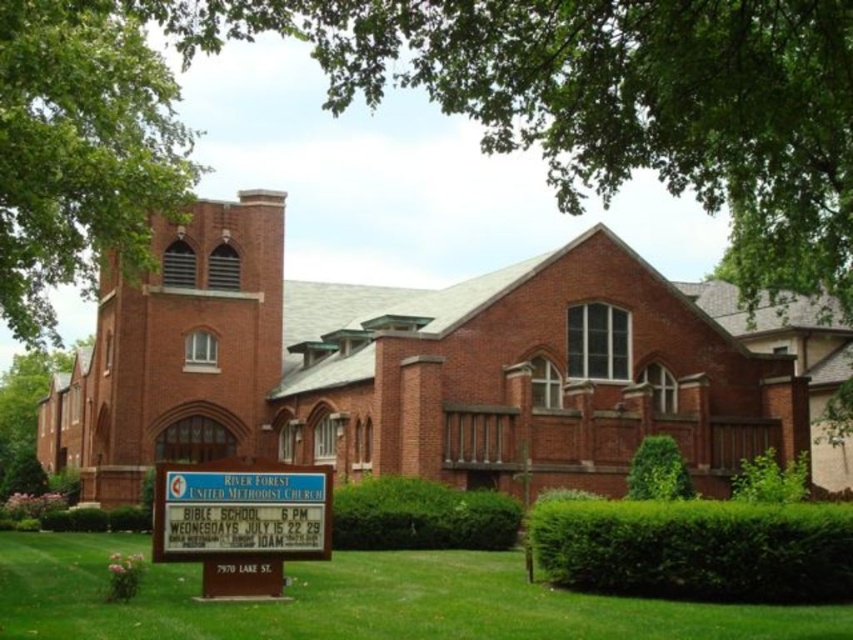
Question: Is brick church at center bigger than white plastic sign at lower center?

Choices:
 (A) no
 (B) yes

Answer: (B)

Question: Does white plastic sign at lower center appear over green leafy hedge at center?

Choices:
 (A) no
 (B) yes

Answer: (B)

Question: Which point is farther to the camera?

Choices:
 (A) (695, 596)
 (B) (380, 586)
 (C) (171, 508)

Answer: (B)

Question: Considering the relative positions of brick church at center and green leafy tree at upper left in the image provided, where is brick church at center located with respect to green leafy tree at upper left?

Choices:
 (A) below
 (B) above

Answer: (A)

Question: Which point is closer to the camera?

Choices:
 (A) (585, 512)
 (B) (643, 461)
 (C) (140, 236)

Answer: (A)

Question: Which point appears closest to the camera in this image?

Choices:
 (A) (508, 561)
 (B) (16, 164)
 (C) (581, 500)

Answer: (C)